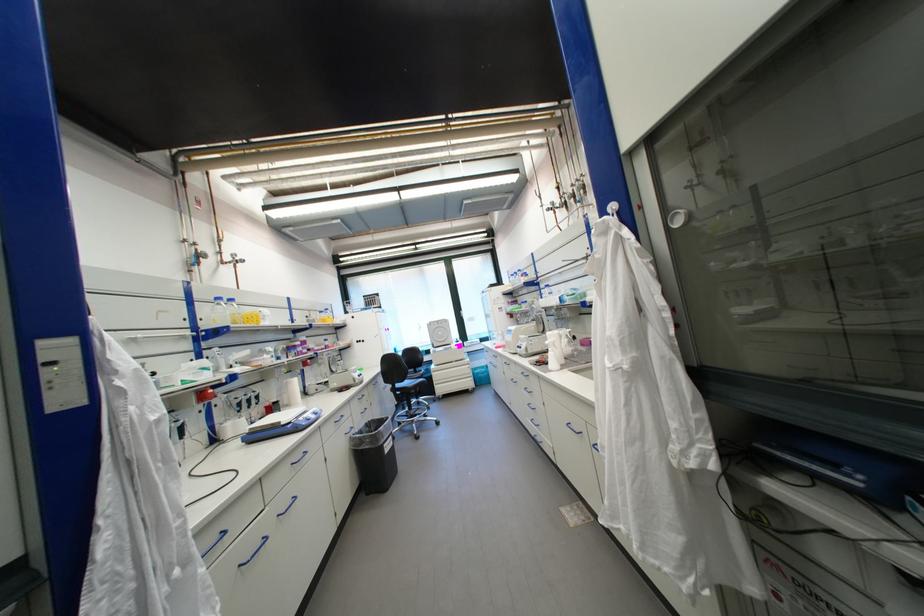
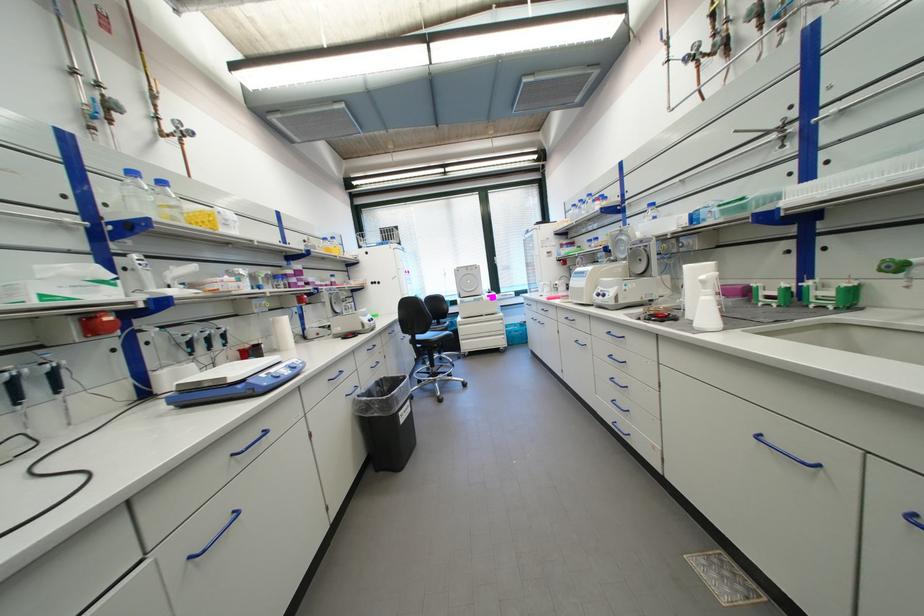
Where in the second image is the point corresponding to (x=438, y=325) from the first image?

(466, 272)